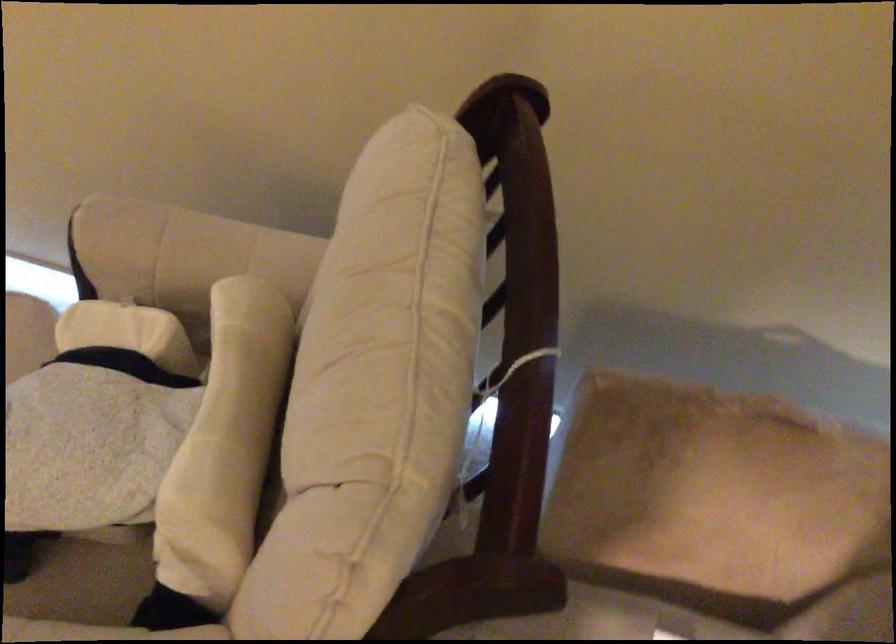
The image size is (896, 644). Find the location of `sofa armrest`. sofa armrest is located at coordinates (181, 250).